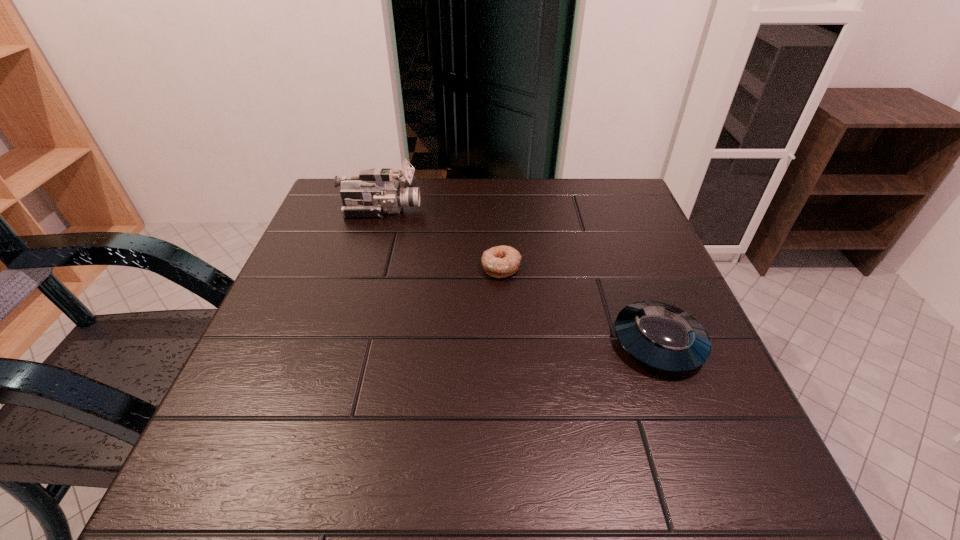
At what (x,y) coordinates should I click in order to perform the action: click on object that is at the left edge. Please return your answer as a coordinate pair (x, y). This screenshot has width=960, height=540. Looking at the image, I should click on (375, 192).

This screenshot has height=540, width=960. I want to click on object that is at the right edge, so click(x=661, y=336).

Image resolution: width=960 pixels, height=540 pixels. In order to click on object positioned at the far left corner in this screenshot , I will do `click(375, 192)`.

In the image, there is a desktop. Where is `vacant space at the far edge`? This screenshot has width=960, height=540. vacant space at the far edge is located at coordinates (468, 192).

This screenshot has height=540, width=960. I want to click on vacant region at the left edge of the desktop, so click(x=294, y=304).

Identify the location of blank space at the right edge of the desktop. (635, 289).

At what (x,y) coordinates should I click in order to perform the action: click on vacant space at the far left corner of the desktop. Please return your answer as a coordinate pair (x, y). Looking at the image, I should click on (329, 207).

This screenshot has width=960, height=540. What are the coordinates of `vacant space at the far right corner of the desktop` in the screenshot? It's located at (635, 195).

This screenshot has width=960, height=540. Identify the location of vacant point located between the rightmost object and the farthest object. (519, 276).

Locate an element on the screen. The width and height of the screenshot is (960, 540). free spot between the saucer and the doughnut is located at coordinates (580, 305).